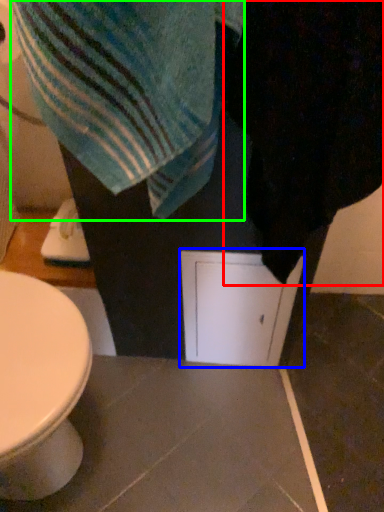
Question: Estimate the real-world distances between objects in this image. Which object is farther from bath towel (highlighted by a red box), screen door (highlighted by a blue box) or beach towel (highlighted by a green box)?

Choices:
 (A) screen door
 (B) beach towel

Answer: (A)